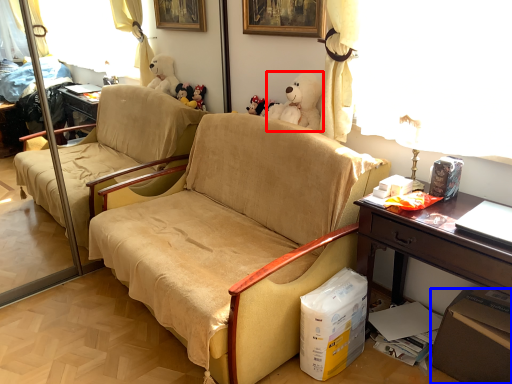
Question: Which object appears farthest to the camera in this image, toy (highlighted by a red box) or box (highlighted by a blue box)?

Choices:
 (A) toy
 (B) box

Answer: (A)